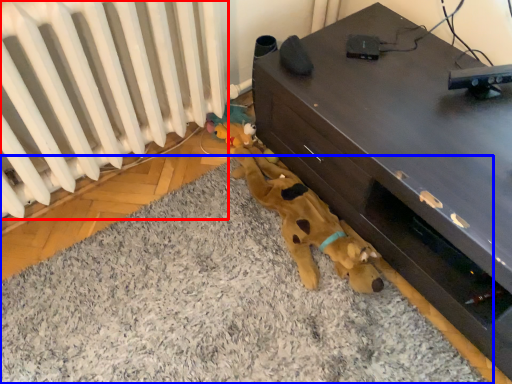
Question: Which object is further to the camera taking this photo, radiator (highlighted by a red box) or mat (highlighted by a blue box)?

Choices:
 (A) radiator
 (B) mat

Answer: (A)